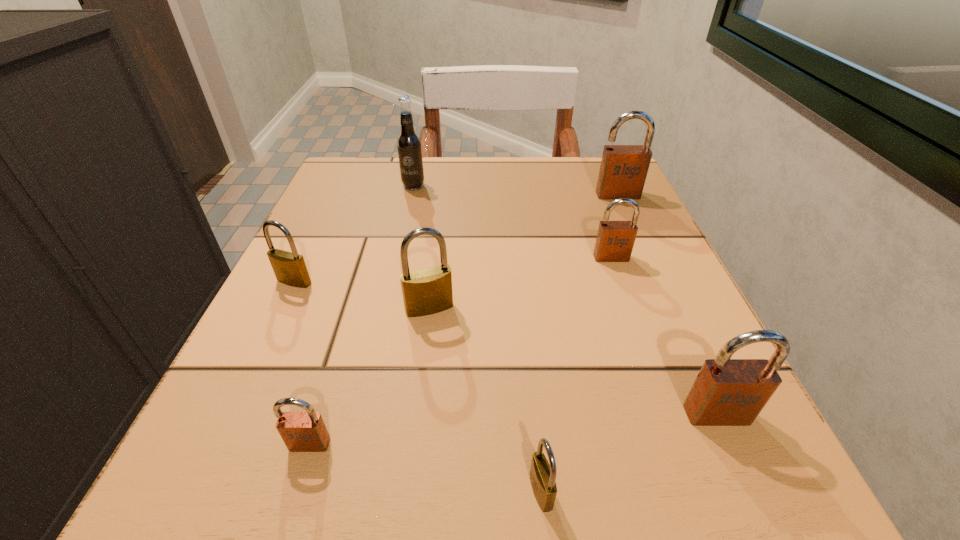
At what (x,y) coordinates should I click in order to perform the action: click on unoccupied area between the smallest brass padlock and the root beer. Please return your answer as a coordinate pair (x, y). The height and width of the screenshot is (540, 960). Looking at the image, I should click on (477, 339).

The height and width of the screenshot is (540, 960). I want to click on blank region between the smallest brown padlock and the fifth nearest object, so click(x=302, y=363).

This screenshot has width=960, height=540. I want to click on object that stands as the second closest to the root beer, so click(x=428, y=291).

Locate which object is the closest to the third biggest brown padlock. Please provide its 2D coordinates. Your answer should be formatted as a tuple, i.e. [(x, y)], where the tuple contains the x and y coordinates of a point satisfying the conditions above.

[(623, 170)]

Locate an element on the screen. the fourth closest padlock to the root beer is located at coordinates (615, 240).

Find the location of a particular element. This screenshot has height=540, width=960. padlock that stands as the fourth closest to the sixth farthest padlock is located at coordinates (727, 392).

This screenshot has width=960, height=540. I want to click on the closest brown padlock to the leftmost brass padlock, so click(300, 431).

Select which brown padlock is the fourth closest to the root beer. Please provide its 2D coordinates. Your answer should be formatted as a tuple, i.e. [(x, y)], where the tuple contains the x and y coordinates of a point satisfying the conditions above.

[(727, 392)]

In order to click on brass padlock identified as the third closest to the third object from left to right in this screenshot , I will do `click(542, 475)`.

Select which brass padlock appears as the second closest to the second smallest brown padlock. Please provide its 2D coordinates. Your answer should be formatted as a tuple, i.e. [(x, y)], where the tuple contains the x and y coordinates of a point satisfying the conditions above.

[(542, 475)]